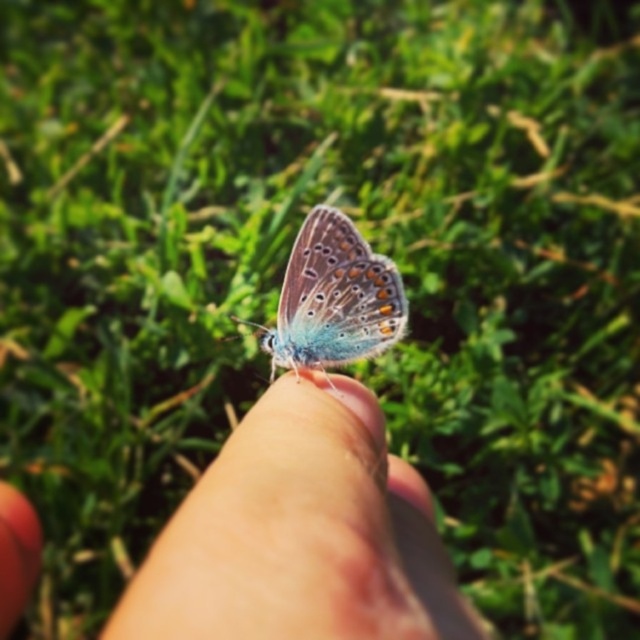
Question: Which point appears farthest from the camera in this image?

Choices:
 (A) (394, 285)
 (B) (259, 609)

Answer: (A)

Question: Does smooth skin finger at center appear on the right side of translucent iridescent butterfly at center?

Choices:
 (A) yes
 (B) no

Answer: (A)

Question: Is the position of smooth skin finger at center less distant than that of translucent iridescent butterfly at center?

Choices:
 (A) yes
 (B) no

Answer: (A)

Question: Does smooth skin finger at center appear under translucent iridescent butterfly at center?

Choices:
 (A) no
 (B) yes

Answer: (B)